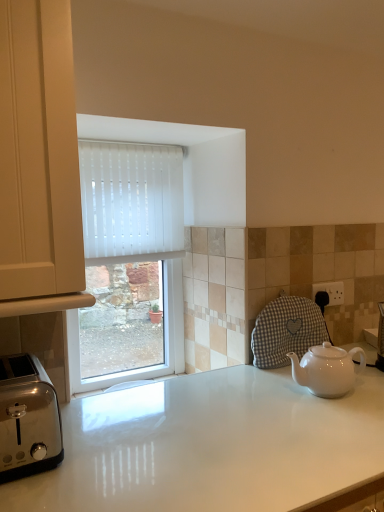
Where is `unoccupied space behind polished stainless steel toaster at lower left`? unoccupied space behind polished stainless steel toaster at lower left is located at coordinates (85, 409).